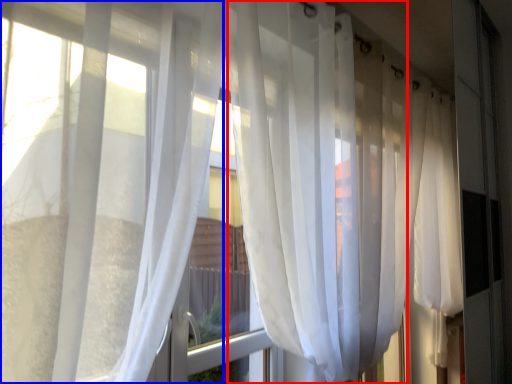
Question: Which point is closer to the camera, curtain (highlighted by a red box) or curtain (highlighted by a blue box)?

Choices:
 (A) curtain
 (B) curtain

Answer: (B)